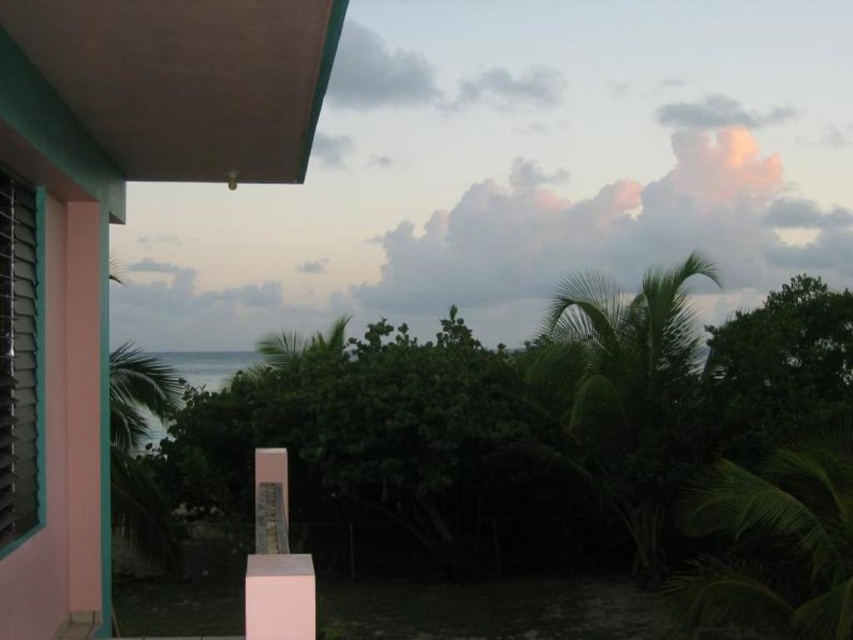
You are standing in the coastal area and want to take a photo of the pink concrete balcony at upper left and the green leafy palm tree at right. Based on their positions, which object should you frame first in your camera viewfinder to ensure both are included in the shot?

The pink concrete balcony at upper left should be framed first since it is positioned to the left of the green leafy palm tree at right, so starting with the leftmost object ensures both are captured in the frame.

You are standing at the base of the green leafy palm tree at right and want to reach the pink concrete balcony at upper left. Which direction should you move to get closer to the balcony?

The pink concrete balcony at upper left is shorter than the green leafy palm tree at right, so you should move towards the left to get closer to the balcony.